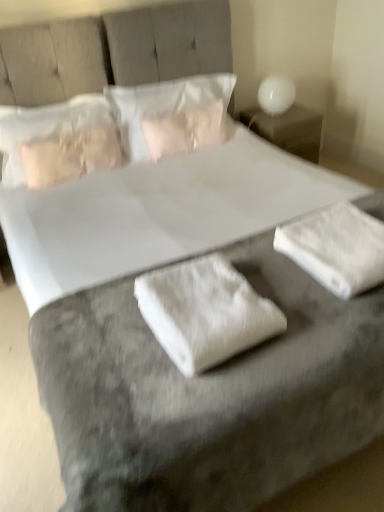
You are a GUI agent. You are given a task and a screenshot of the screen. Output one action in this format:
    pyautogui.click(x=<x>, y=<y>)
    Task: Click on the vacant space in front of white fluffy towel at lower right, arranged as the second material when viewed from the left
    The height and width of the screenshot is (512, 384).
    Given the screenshot: What is the action you would take?
    pyautogui.click(x=335, y=322)